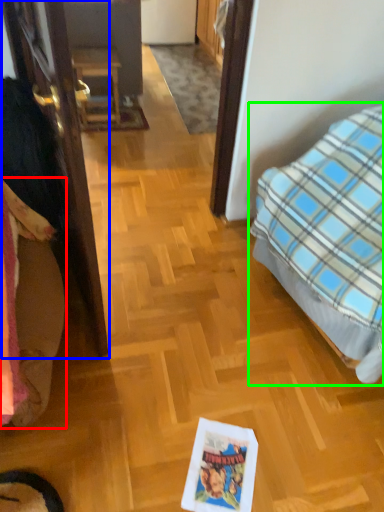
Question: Which object is positioned closest to bedding (highlighted by a red box)? Select from door (highlighted by a blue box) and bed (highlighted by a green box).

Choices:
 (A) door
 (B) bed

Answer: (A)